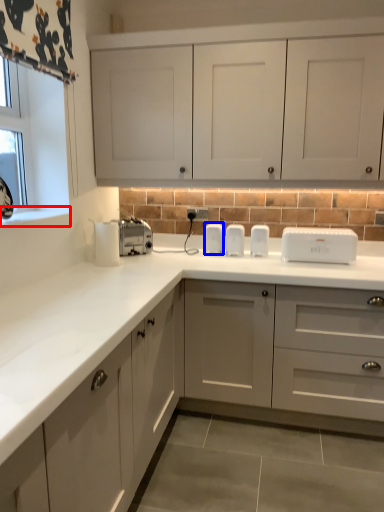
Question: Which of the following is the closest to the observer, window sill (highlighted by a red box) or appliance (highlighted by a blue box)?

Choices:
 (A) window sill
 (B) appliance

Answer: (A)